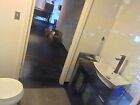
This screenshot has width=140, height=105. I want to click on wall to the left of toilet, so (x=3, y=44).